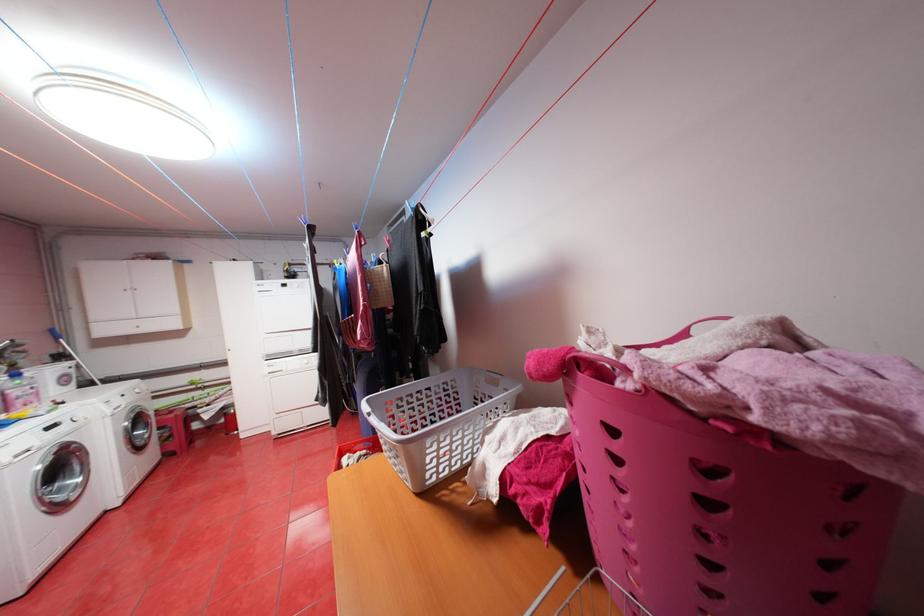
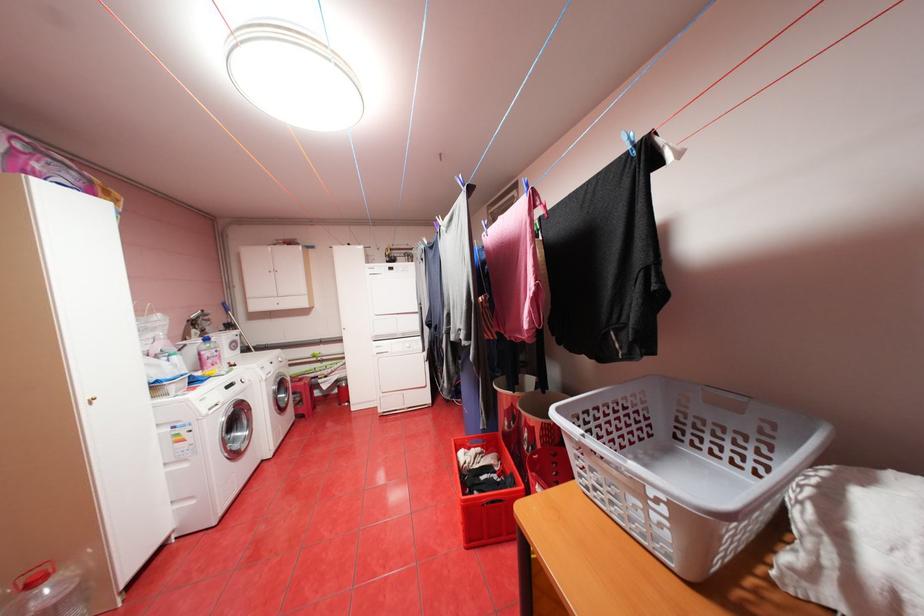
Locate, in the second image, the point that corresponds to (372,451) in the first image.

(488, 448)